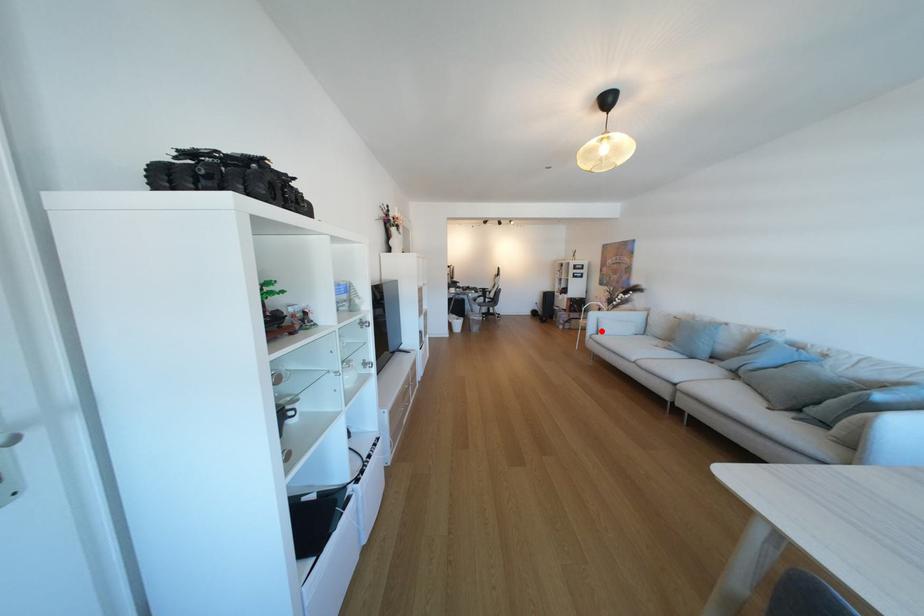
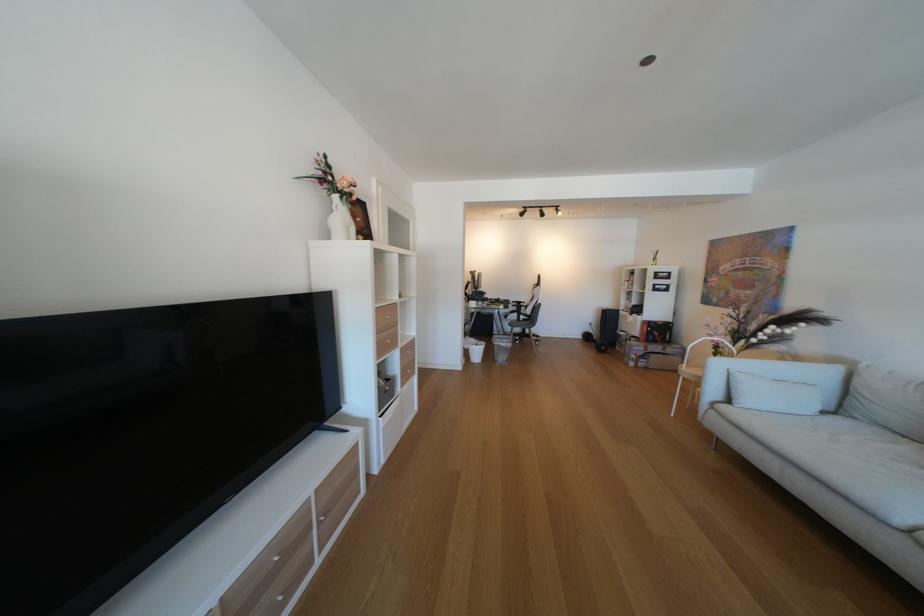
Question: A red point is marked in image1. In image2, is the corresponding 3D point closer to the camera or farther? Reply with the corresponding letter.

Choices:
 (A) The corresponding 3D point is closer.
 (B) The corresponding 3D point is farther.

Answer: (B)